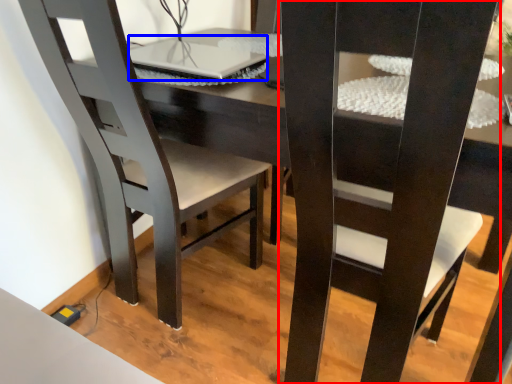
Question: Which object appears farthest to the camera in this image, chair (highlighted by a red box) or laptop (highlighted by a blue box)?

Choices:
 (A) chair
 (B) laptop

Answer: (B)